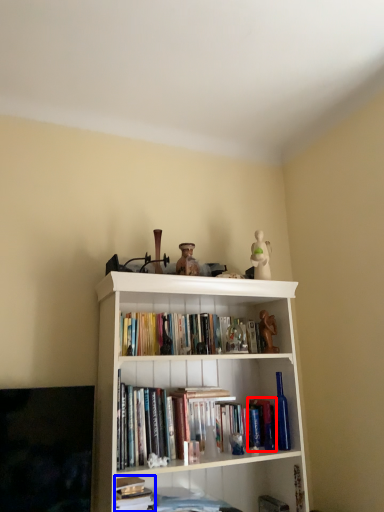
Question: Among these objects, which one is nearest to the camera, paperback book (highlighted by a red box) or book (highlighted by a blue box)?

Choices:
 (A) paperback book
 (B) book

Answer: (B)